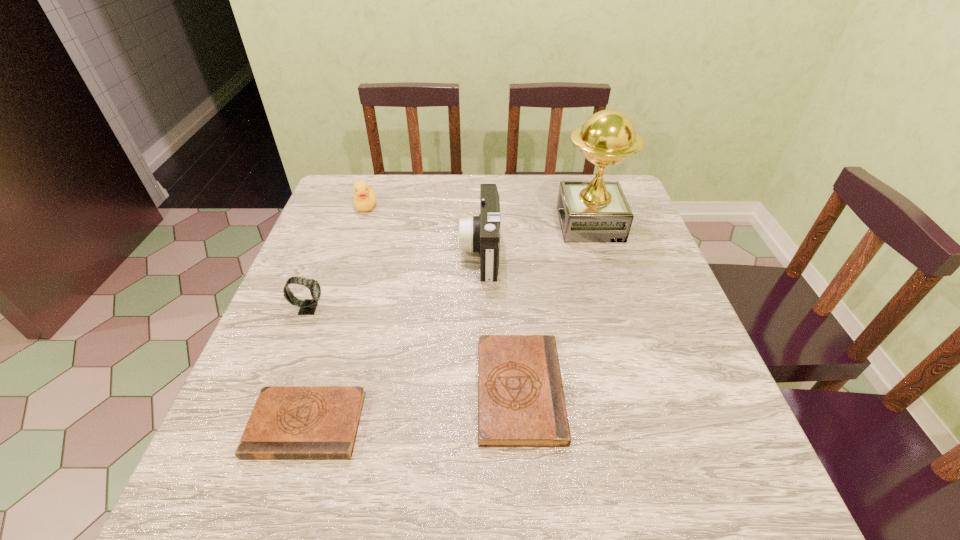
Find the location of a particular element. This screenshot has width=960, height=540. the shorter diary is located at coordinates (287, 422).

I want to click on the left diary, so click(287, 422).

The height and width of the screenshot is (540, 960). Identify the location of the right diary. (521, 403).

You are a GUI agent. You are given a task and a screenshot of the screen. Output one action in this format:
    pyautogui.click(x=<x>, y=<y>)
    Task: Click on the second shortest object
    Image resolution: width=960 pixels, height=540 pixels.
    Given the screenshot: What is the action you would take?
    pyautogui.click(x=521, y=403)

This screenshot has width=960, height=540. In order to click on duckling in this screenshot , I will do `click(365, 198)`.

This screenshot has height=540, width=960. Identify the location of the tallest object. (597, 211).

Where is `the rightmost object`? This screenshot has height=540, width=960. the rightmost object is located at coordinates (597, 211).

I want to click on camcorder, so click(481, 233).

The height and width of the screenshot is (540, 960). Find the location of `the third nearest object`. the third nearest object is located at coordinates (307, 307).

Find the location of `vacant point located on the spine side of the right diary`. vacant point located on the spine side of the right diary is located at coordinates (635, 390).